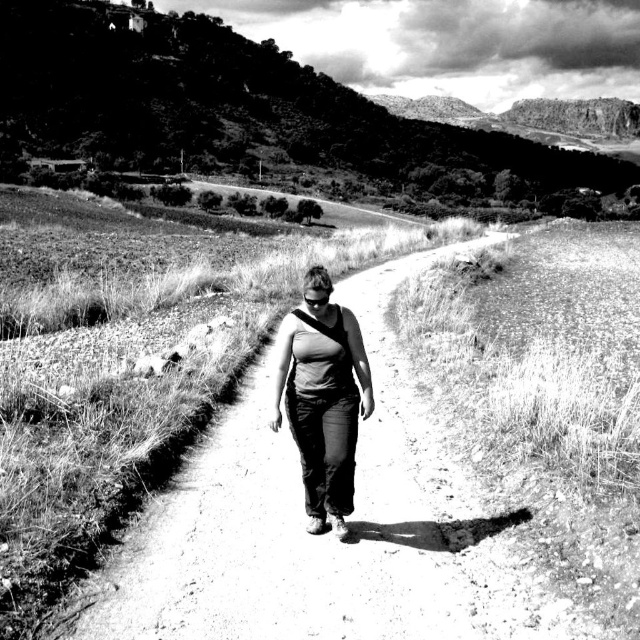
Question: Does grassy hillside at upper center appear over dark gray fabric tank top at center?

Choices:
 (A) no
 (B) yes

Answer: (B)

Question: Is grassy hillside at upper center positioned at the back of dark gray fabric tank top at center?

Choices:
 (A) no
 (B) yes

Answer: (B)

Question: Which point is farther to the camera?

Choices:
 (A) 348,483
 (B) 445,148

Answer: (B)

Question: Does grassy hillside at upper center appear under dark gray fabric tank top at center?

Choices:
 (A) no
 (B) yes

Answer: (A)